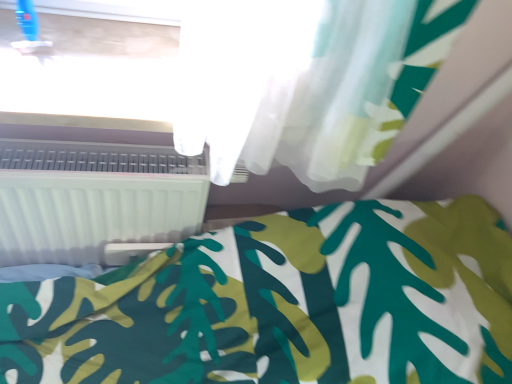
Question: Is white plastic window frame at upper center looking in the opposite direction of white fabric bed at lower right?

Choices:
 (A) yes
 (B) no

Answer: (B)

Question: Does white plastic window frame at upper center have a smaller size compared to white fabric bed at lower right?

Choices:
 (A) yes
 (B) no

Answer: (A)

Question: Is white plastic window frame at upper center to the left of white fabric bed at lower right from the viewer's perspective?

Choices:
 (A) no
 (B) yes

Answer: (B)

Question: Does white plastic window frame at upper center lie in front of white fabric bed at lower right?

Choices:
 (A) yes
 (B) no

Answer: (B)

Question: Does white plastic window frame at upper center appear on the right side of white fabric bed at lower right?

Choices:
 (A) no
 (B) yes

Answer: (A)

Question: Would you say white plastic window frame at upper center is a long distance from white fabric bed at lower right?

Choices:
 (A) yes
 (B) no

Answer: (B)

Question: Is white plastic radiator at lower left not close to white plastic window frame at upper center?

Choices:
 (A) yes
 (B) no

Answer: (B)

Question: From a real-world perspective, is white plastic radiator at lower left positioned under white plastic window frame at upper center based on gravity?

Choices:
 (A) yes
 (B) no

Answer: (A)

Question: From the image's perspective, is white plastic radiator at lower left beneath white plastic window frame at upper center?

Choices:
 (A) yes
 (B) no

Answer: (A)

Question: From the image's perspective, is white plastic radiator at lower left over white plastic window frame at upper center?

Choices:
 (A) yes
 (B) no

Answer: (B)

Question: Does white plastic radiator at lower left turn towards white plastic window frame at upper center?

Choices:
 (A) yes
 (B) no

Answer: (B)

Question: Is white plastic window frame at upper center completely or partially inside white plastic radiator at lower left?

Choices:
 (A) yes
 (B) no

Answer: (B)

Question: Is white plastic window frame at upper center located outside white plastic radiator at lower left?

Choices:
 (A) no
 (B) yes

Answer: (B)